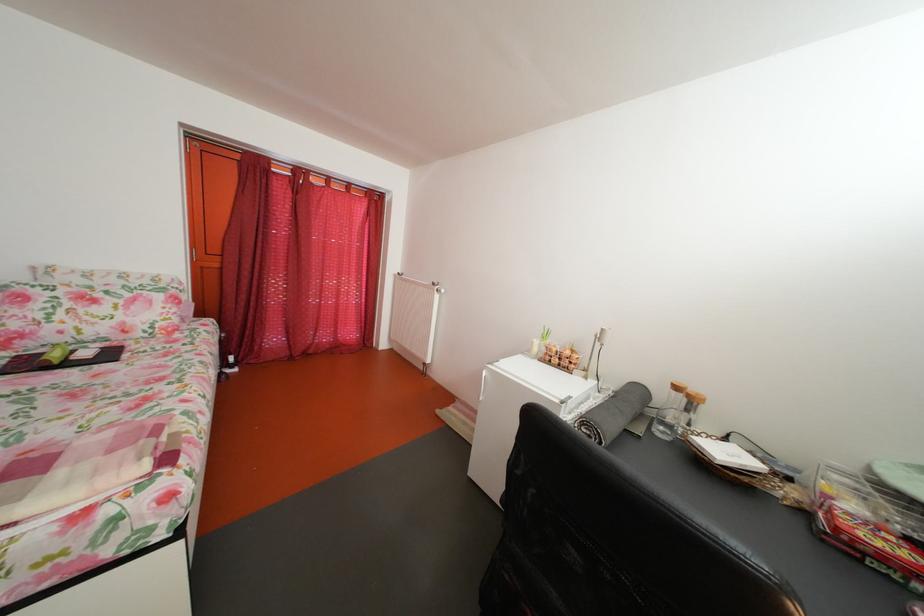
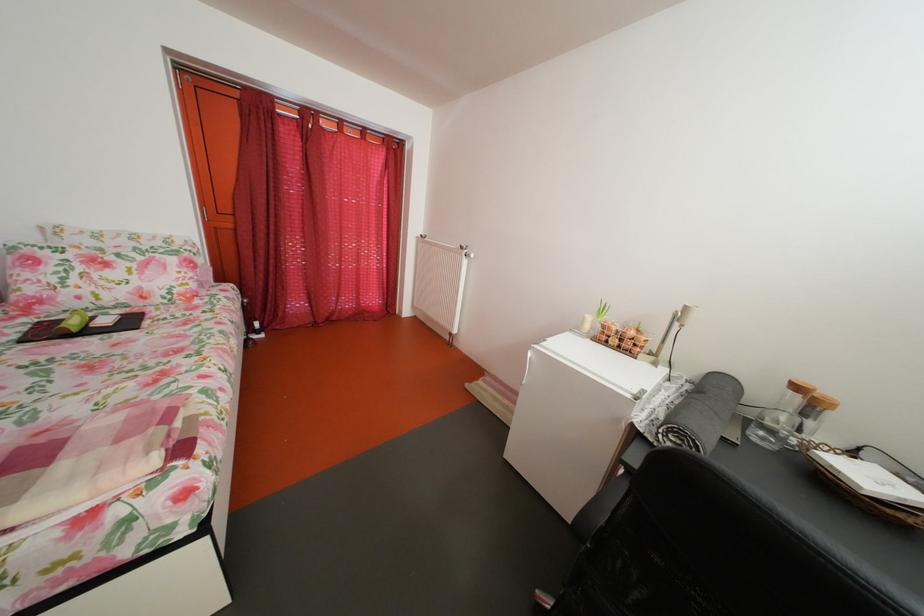
Locate, in the second image, the point that corresponds to [703,408] in the first image.

(824, 411)